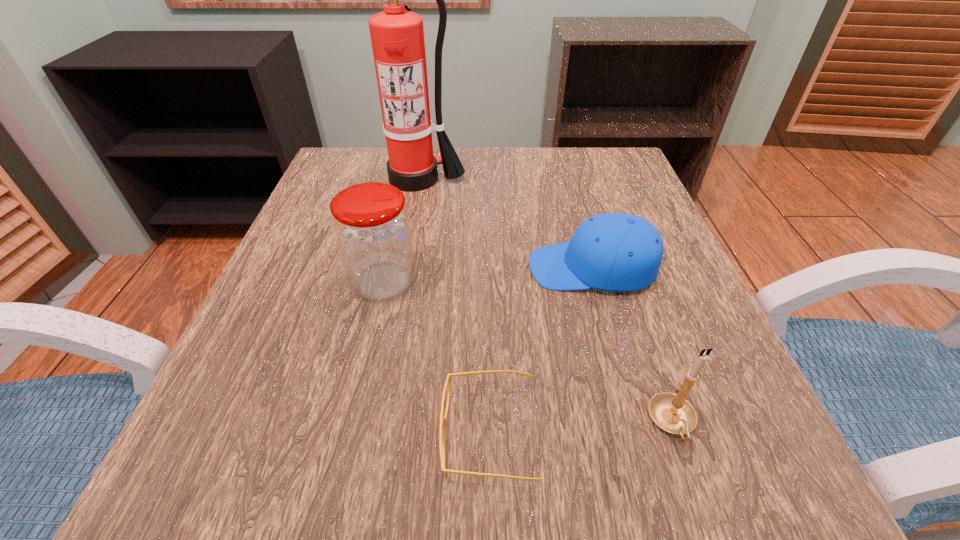
Find the location of a particular element. This screenshot has width=960, height=540. object that is the fourth closest to the fourth tallest object is located at coordinates (397, 36).

In order to click on vacant position in the image that satisfies the following two spatial constraints: 1. on the handle side of the third shortest object; 2. in front of the lenses of the shortest object in this screenshot , I will do `click(676, 434)`.